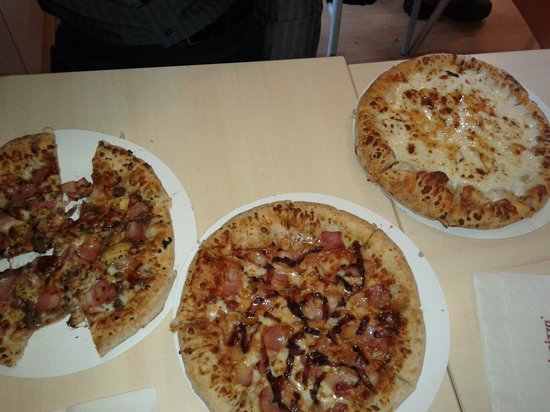
Locate an element on the screen. The height and width of the screenshot is (412, 550). table tops is located at coordinates (270, 123), (450, 254).